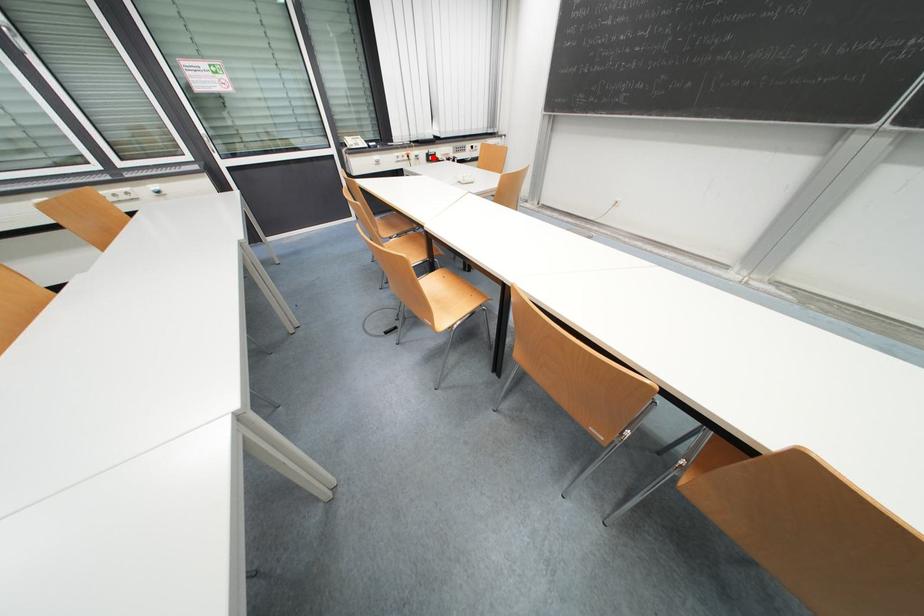
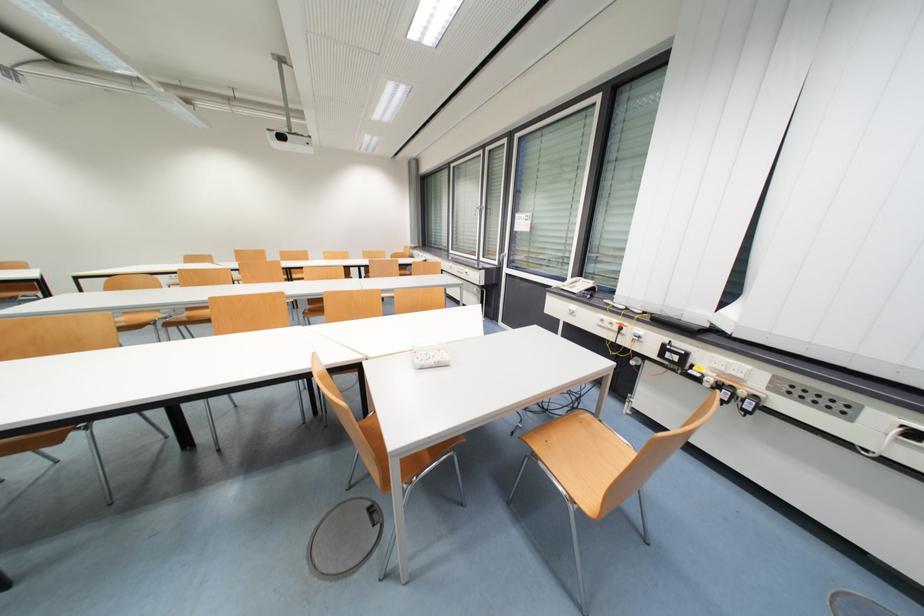
Find the pixel in the second image that matches the highlighted location in the first image.

(671, 350)